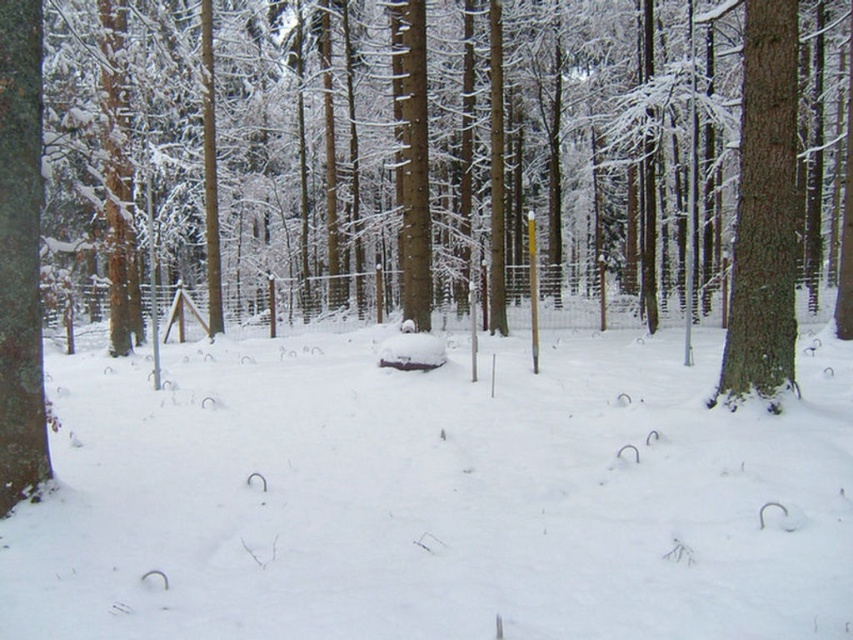
Does white fluffy snow at center have a greater width compared to smooth bark tree at right?

Indeed, white fluffy snow at center has a greater width compared to smooth bark tree at right.

Looking at this image, can you confirm if white fluffy snow at center is positioned above smooth bark tree at right?

No.

Is point (328, 488) behind point (753, 236)?

No, (328, 488) is closer to viewer.

In order to click on white fluffy snow at center in this screenshot , I will do `click(436, 497)`.

Can you confirm if white fluffy snow at center is thinner than smooth brown tree trunk at left?

Incorrect, white fluffy snow at center's width is not less than smooth brown tree trunk at left's.

Between white fluffy snow at center and smooth brown tree trunk at left, which one appears on the right side from the viewer's perspective?

white fluffy snow at center

At what (x,y) coordinates should I click in order to perform the action: click on white fluffy snow at center. Please return your answer as a coordinate pair (x, y). The height and width of the screenshot is (640, 853). Looking at the image, I should click on (436, 497).

Which is in front, point (792, 51) or point (41, 42)?

Positioned in front is point (41, 42).

Between smooth bark tree at right and smooth brown tree trunk at left, which one appears on the left side from the viewer's perspective?

From the viewer's perspective, smooth brown tree trunk at left appears more on the left side.

What do you see at coordinates (764, 209) in the screenshot? The image size is (853, 640). I see `smooth bark tree at right` at bounding box center [764, 209].

Image resolution: width=853 pixels, height=640 pixels. In order to click on smooth bark tree at right in this screenshot , I will do `click(764, 209)`.